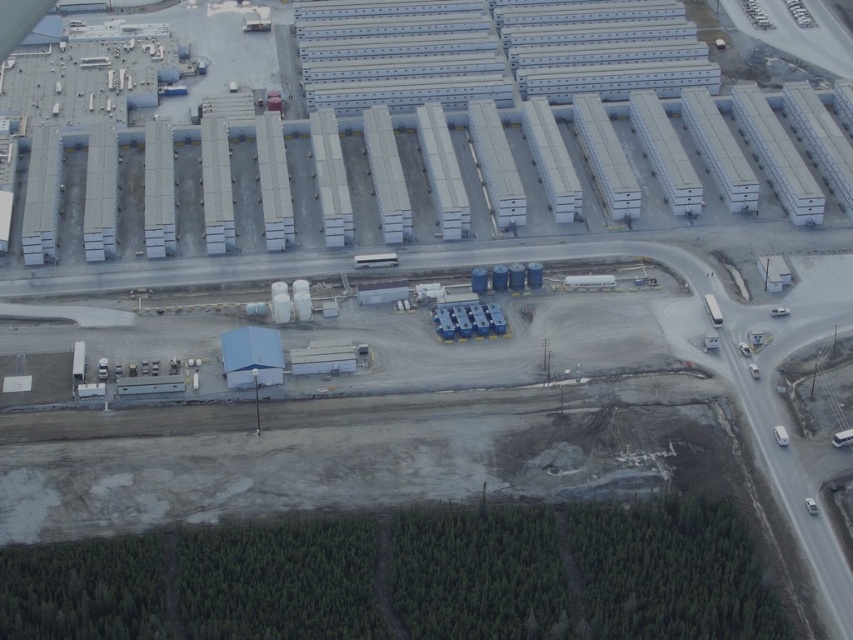
You are a delivery truck driver approaching the industrial complex from the north. Your GPS shows the white corrugated metal warehouse at upper center is your destination. The paved road runs horizontally across the image. Which direction should you drive along the road to reach the warehouse?

The white corrugated metal warehouse at upper center is located at point (x=431, y=173), so you should drive east along the road to reach it.

You are a delivery truck driver who needs to unload cargo into the white corrugated metal warehouse at upper center and the white corrugated metal containers at upper center. Which one should you approach first if you want to reach the one that is closer to you?

The white corrugated metal warehouse at upper center is closer to the viewer than the white corrugated metal containers at upper center, so you should approach the white corrugated metal warehouse at upper center first.